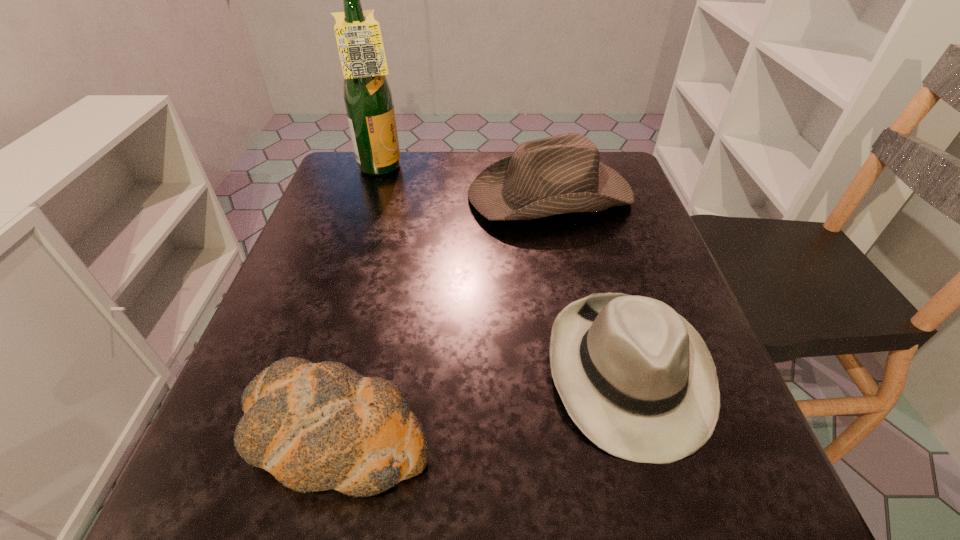
In the image, there is a desktop. Where is `vacant region at the near edge`? The width and height of the screenshot is (960, 540). vacant region at the near edge is located at coordinates (512, 529).

Identify the location of free region at the right edge of the desktop. This screenshot has width=960, height=540. (600, 226).

I want to click on free space between the taller fedora and the shorter fedora, so click(x=588, y=283).

Where is `free spot between the second tallest object and the nearer fedora`? This screenshot has width=960, height=540. free spot between the second tallest object and the nearer fedora is located at coordinates (588, 283).

Locate an element on the screen. vacant area that lies between the nearer fedora and the farther fedora is located at coordinates (588, 283).

This screenshot has width=960, height=540. Identify the location of free spot between the shorter fedora and the second tallest object. (588, 283).

Where is `free space between the tallest object and the bread`? This screenshot has width=960, height=540. free space between the tallest object and the bread is located at coordinates (358, 302).

At what (x,y) coordinates should I click in order to perform the action: click on vacant region between the tallest object and the nearer fedora. Please return your answer as a coordinate pair (x, y). This screenshot has width=960, height=540. Looking at the image, I should click on (505, 270).

The image size is (960, 540). Find the location of `empty space between the bread and the third shortest object`. empty space between the bread and the third shortest object is located at coordinates (442, 315).

Where is `vacant space in between the nearer fedora and the taller fedora`? The image size is (960, 540). vacant space in between the nearer fedora and the taller fedora is located at coordinates tap(588, 283).